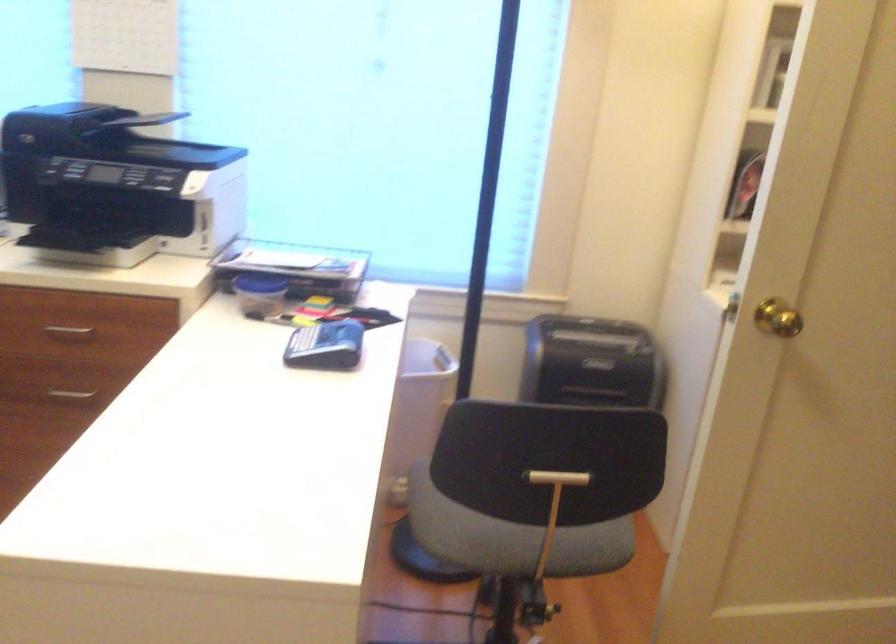
Where would you sit the chair sitting surface? Please return your answer as a coordinate pair (x, y).

(535, 495)